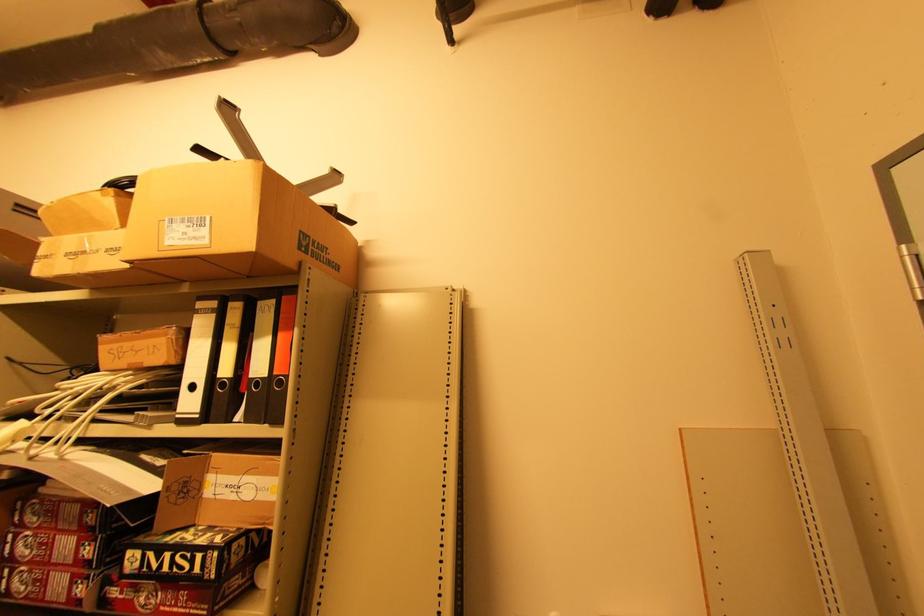
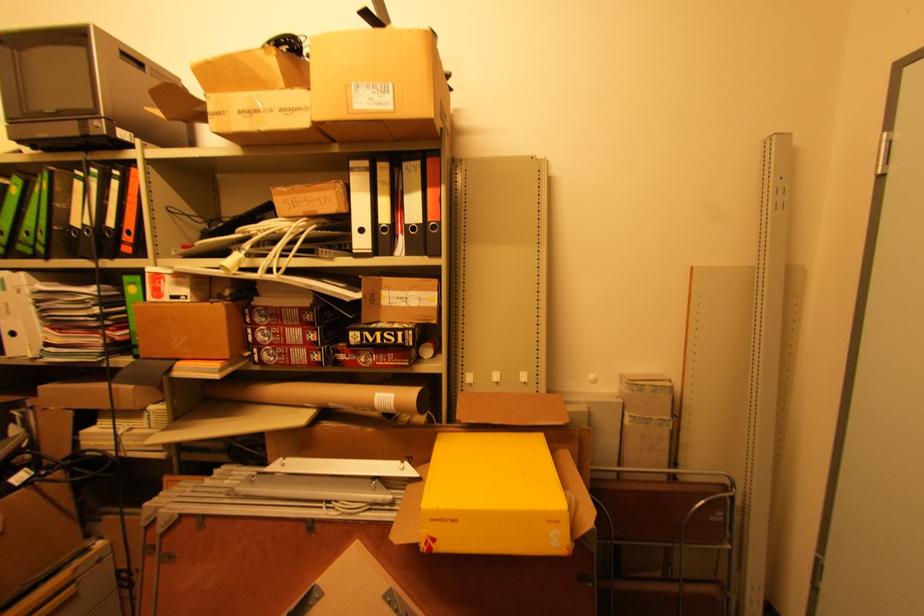
In a continuous first-person perspective shot, in which direction is the camera moving?

The cameraman walked toward left, backward.